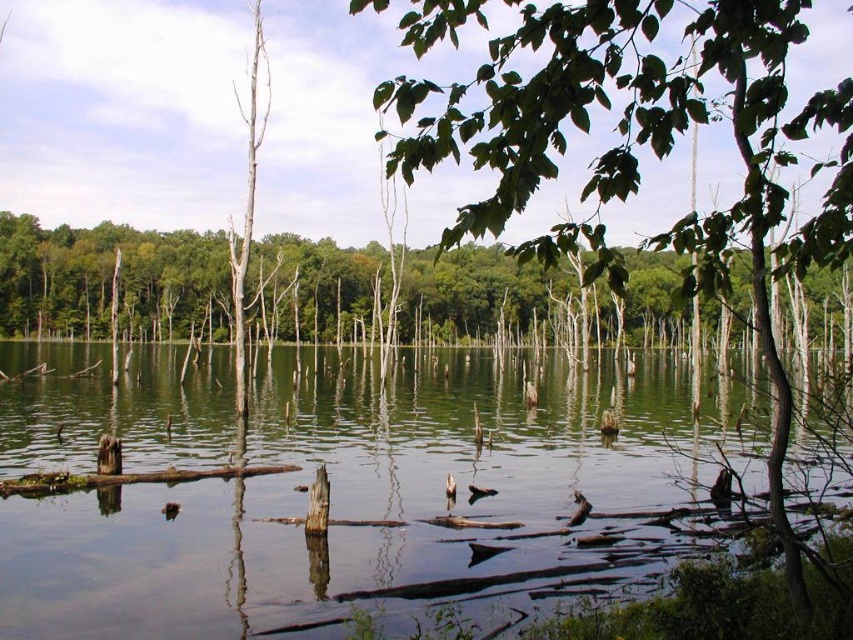
Can you confirm if green leafy tree at upper center is smaller than green matte tree at center?

Actually, green leafy tree at upper center might be larger than green matte tree at center.

Based on the photo, who is more forward, (421, 122) or (247, 300)?

Point (421, 122) is in front.

Who is more forward, [631,35] or [140,310]?

Point [631,35]

You are a GUI agent. You are given a task and a screenshot of the screen. Output one action in this format:
    pyautogui.click(x=<x>, y=<y>)
    Task: Click on the green leafy tree at upper center
    Image resolution: width=853 pixels, height=640 pixels.
    Given the screenshot: What is the action you would take?
    pyautogui.click(x=648, y=147)

Is point (416, 433) behind point (395, 160)?

Yes, it is.

Between green reflective water at center and green leafy tree at upper center, which one appears on the left side from the viewer's perspective?

green reflective water at center

Locate an element on the screen. green reflective water at center is located at coordinates (329, 480).

Between green reflective water at center and green matte tree at center, which one is positioned lower?

green reflective water at center

How much distance is there between green reflective water at center and green matte tree at center?

They are 157.27 feet apart.

Identify the location of green reflective water at center. (329, 480).

Where is `green reflective water at center`? This screenshot has width=853, height=640. green reflective water at center is located at coordinates (329, 480).